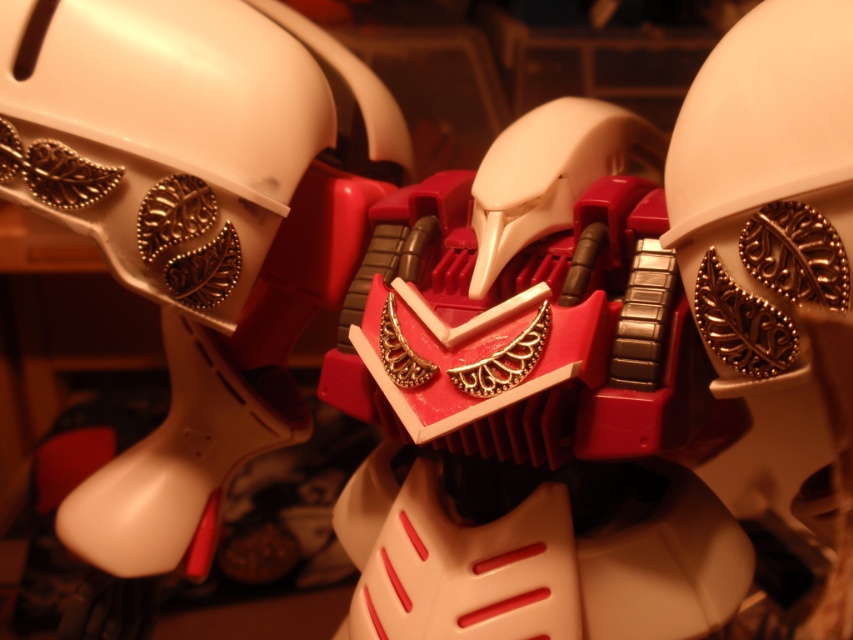
Question: Which object appears farthest from the camera in this image?

Choices:
 (A) white matte helmet at upper center
 (B) matte red plastic robot at center

Answer: (A)

Question: Which object is the closest to the white matte helmet at upper right?

Choices:
 (A) white matte helmet at upper center
 (B) matte red plastic robot at center

Answer: (B)

Question: Which object is the farthest from the white matte helmet at upper right?

Choices:
 (A) matte red plastic robot at center
 (B) white matte helmet at upper center

Answer: (B)

Question: Is white matte helmet at upper center smaller than white matte helmet at upper right?

Choices:
 (A) yes
 (B) no

Answer: (B)

Question: Can you confirm if matte red plastic robot at center is bigger than white matte helmet at upper right?

Choices:
 (A) yes
 (B) no

Answer: (A)

Question: Is white matte helmet at upper center smaller than white matte helmet at upper right?

Choices:
 (A) no
 (B) yes

Answer: (A)